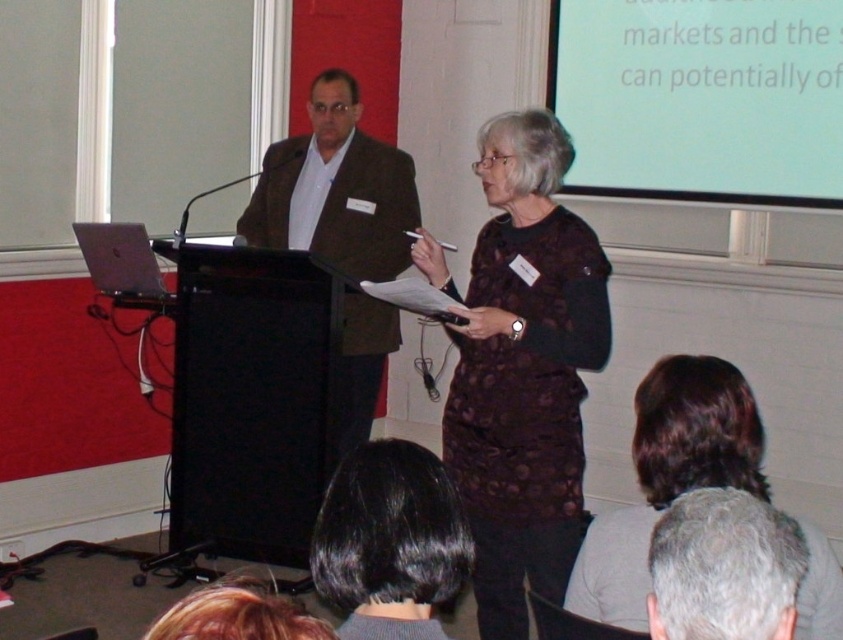
You are an attendee at the presentation and want to see both the dark brown hair at upper center and the gray hair at upper center. Which one would appear closer to you?

The dark brown hair at upper center appears closer to you because it is further to the viewer than the gray hair at upper center.

You are an attendee at the presentation and need to locate the white matte projection screen at upper center. Based on the coordinates provided in the Objects Description, can you determine its position relative to the speaker at the podium?

The white matte projection screen at upper center is located at coordinates point (701, 99), which places it above and slightly to the left of the speaker at the podium. This means the screen is positioned higher up in the room and to the left side from the speaker.

You are sitting in the front row of the presentation. You want to hand the speaker a note. The note is in your pocket, and you need to reach forward to give it to him. The podium is between you and the dark brown textured dress at center. Can you estimate whether you can reach him without leaving your seat?

The dark brown textured dress at center is 8.44 feet away from the viewer. Since the average human arm length is around 2.5 feet, you cannot reach the speaker from your seat as the distance is much greater than the arm length.